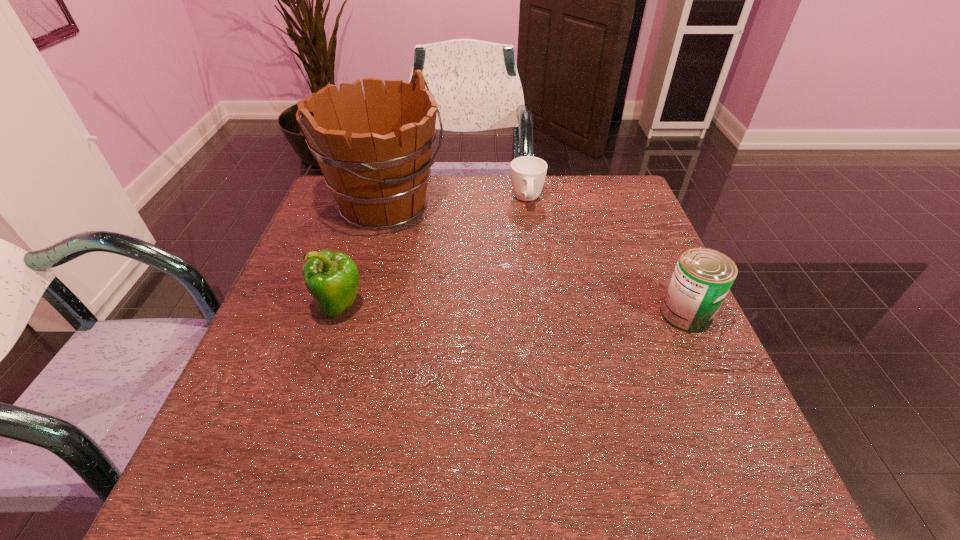
This screenshot has height=540, width=960. In order to click on vacant area situated 0.130m with the handle on the side of the cup in this screenshot , I will do `click(533, 245)`.

Where is `vacant space situated 0.220m with the handle on the wine bucket`? vacant space situated 0.220m with the handle on the wine bucket is located at coordinates (486, 273).

This screenshot has width=960, height=540. What are the coordinates of `vacant space situated 0.300m with the handle on the wine bucket` in the screenshot? It's located at (512, 289).

Where is `free space located 0.330m with the handle on the wine bucket`? The width and height of the screenshot is (960, 540). free space located 0.330m with the handle on the wine bucket is located at coordinates (521, 296).

You are a GUI agent. You are given a task and a screenshot of the screen. Output one action in this format:
    pyautogui.click(x=<x>, y=<y>)
    Task: Click on the cup present at the far edge
    This screenshot has width=960, height=540.
    Given the screenshot: What is the action you would take?
    pyautogui.click(x=528, y=173)

This screenshot has height=540, width=960. Identify the location of wine bucket located at the far edge. (379, 180).

The width and height of the screenshot is (960, 540). I want to click on bell pepper positioned at the left edge, so click(x=332, y=279).

Where is `wine bucket that is at the left edge`? The height and width of the screenshot is (540, 960). wine bucket that is at the left edge is located at coordinates (379, 180).

The image size is (960, 540). Identify the location of object situated at the right edge. click(702, 278).

Locate an element on the screen. The width and height of the screenshot is (960, 540). object that is at the far left corner is located at coordinates (379, 180).